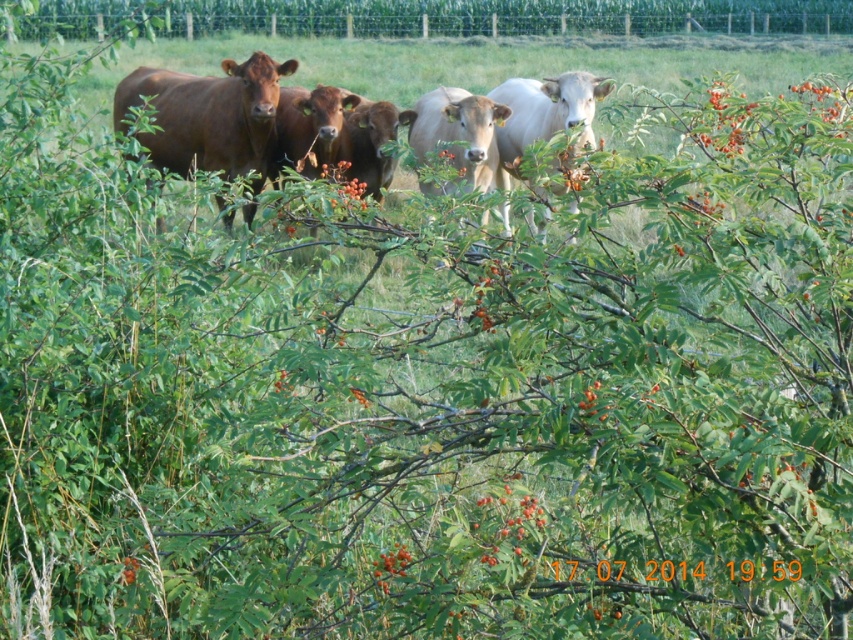
You are a farmer checking on your herd. You notice the matte brown cow at center and the white glossy bull at center. Which animal is closer to you?

The matte brown cow at center is closer to you because the white glossy bull at center is behind it.

You are a farmer who wants to separate the brown glossy cows at center from the white glossy bull at center using a fence. Based on their positions, which side of the fence should you place the cows on to keep them to the left of the bull?

The brown glossy cows at center are already positioned to the left of the white glossy bull at center, so you should place the fence to the right of the cows to maintain their leftward placement relative to the bull.

Based on the photo, you are a farmer checking on your cows. You notice two cows in the center of the field. One is brown glossy cows at center and the other is matte brown cow at center. Which cow is positioned to the right when viewed from your perspective?

The brown glossy cows at center is positioned to the right of the matte brown cow at center.